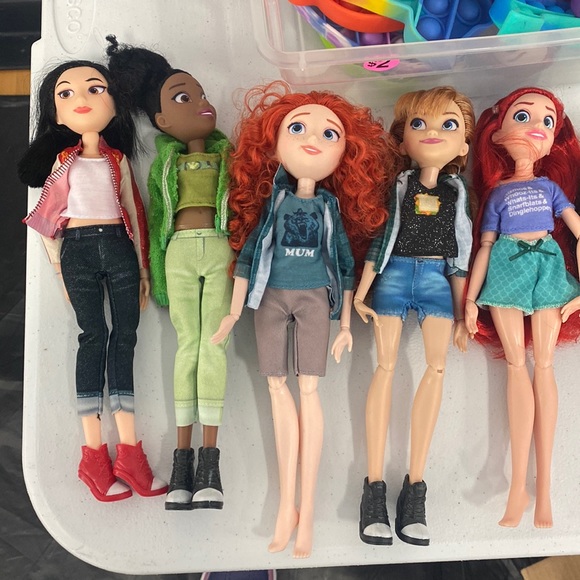
Where is `toys`? The width and height of the screenshot is (580, 580). toys is located at coordinates (517, 119).